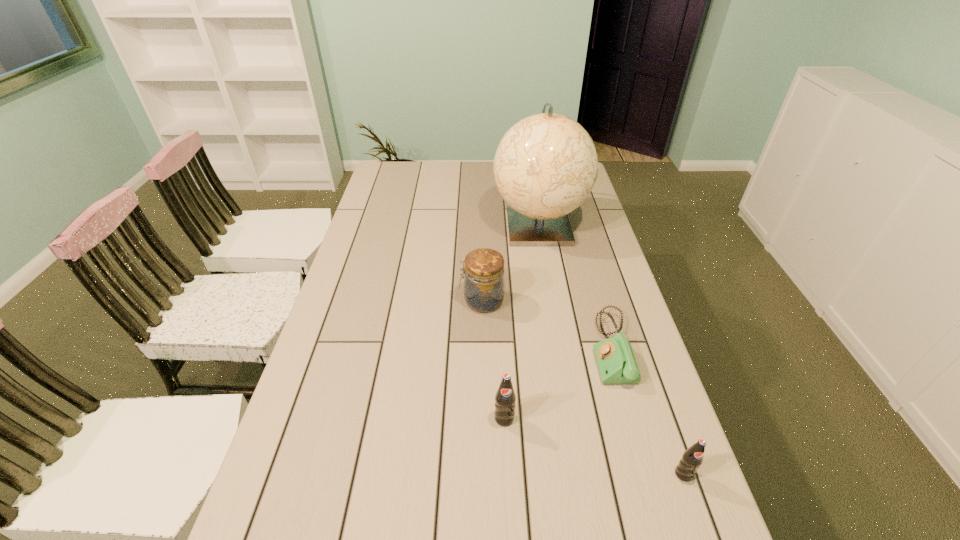
Identify the location of the fourth farthest object. Image resolution: width=960 pixels, height=540 pixels. (505, 398).

Find the location of a particular element. The height and width of the screenshot is (540, 960). the farther pop is located at coordinates (505, 398).

The width and height of the screenshot is (960, 540). In order to click on the nearer pop in this screenshot , I will do `click(692, 458)`.

This screenshot has height=540, width=960. In order to click on the right pop in this screenshot , I will do `click(692, 458)`.

What are the coordinates of `the tallest object` in the screenshot? It's located at coord(546,165).

The height and width of the screenshot is (540, 960). Identify the location of the farthest object. (546, 165).

Find the location of a particular element. Image resolution: width=960 pixels, height=540 pixels. jar is located at coordinates (484, 286).

Identify the location of the shortest object. (616, 361).

You are a GUI agent. You are given a task and a screenshot of the screen. Output one action in this format:
    pyautogui.click(x=<x>, y=<y>)
    Task: Click on the vacant space located on the front label of the left pop
    This screenshot has height=540, width=960.
    Given the screenshot: What is the action you would take?
    pyautogui.click(x=508, y=504)

Where is `vacant space positioned 0.390m on the surface of the globe showing Europe and Africa`? This screenshot has width=960, height=540. vacant space positioned 0.390m on the surface of the globe showing Europe and Africa is located at coordinates (560, 346).